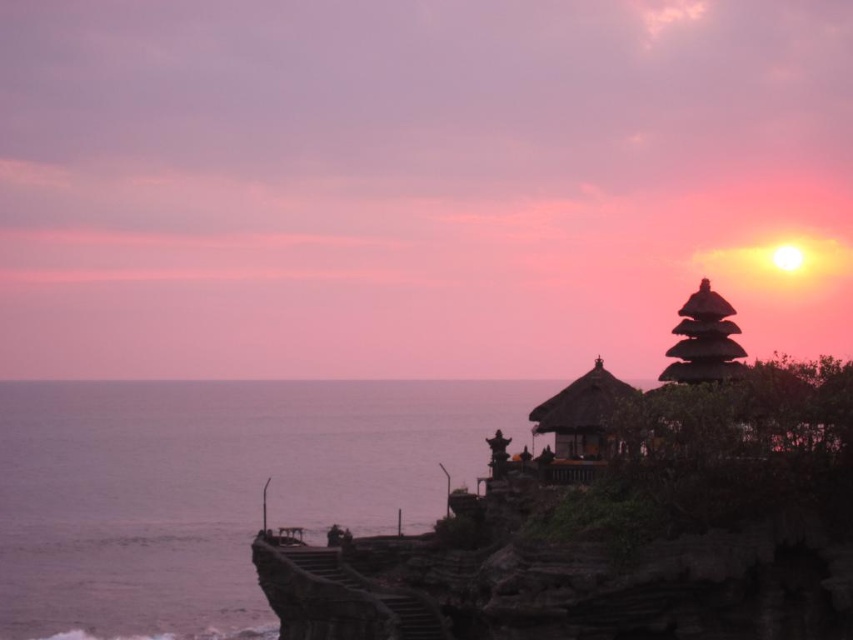
You are a photographer standing at the cliff edge near the temple. You want to capture a photo of the silvery water at lower left. Considering the distance between you and the water, is it advisable to use a telephoto lens to get a closeup shot?

The distance between you and the silvery water at lower left is 87.58 meters. Using a telephoto lens would allow you to magnify the silvery water at lower left from that distance, making it the focal point of your photo.

You are standing at the cliff edge overlooking the temple and the ocean. You notice a point marked at coordinates (213, 490). Based on the scene description, what does this point most likely represent?

The point at (213, 490) most likely represents the silvery water at lower left as described in the scene.

Consider the image. You are a tourist standing at the edge of the cliff, looking out at the sunset. You see the silvery water at lower left and the dark brown wooden gazebo at upper right. Which object is positioned higher in the scene?

The dark brown wooden gazebo at upper right is positioned higher than the silvery water at lower left.